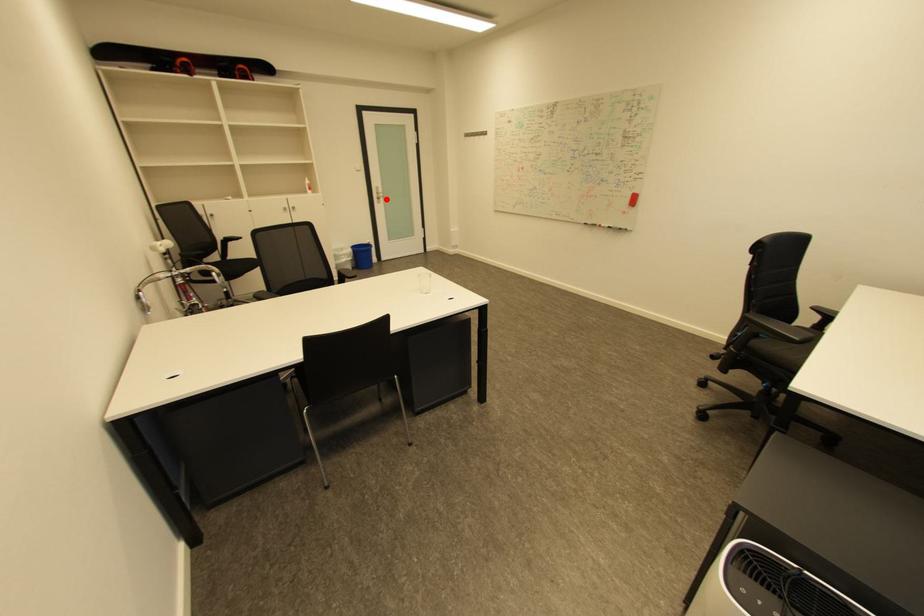
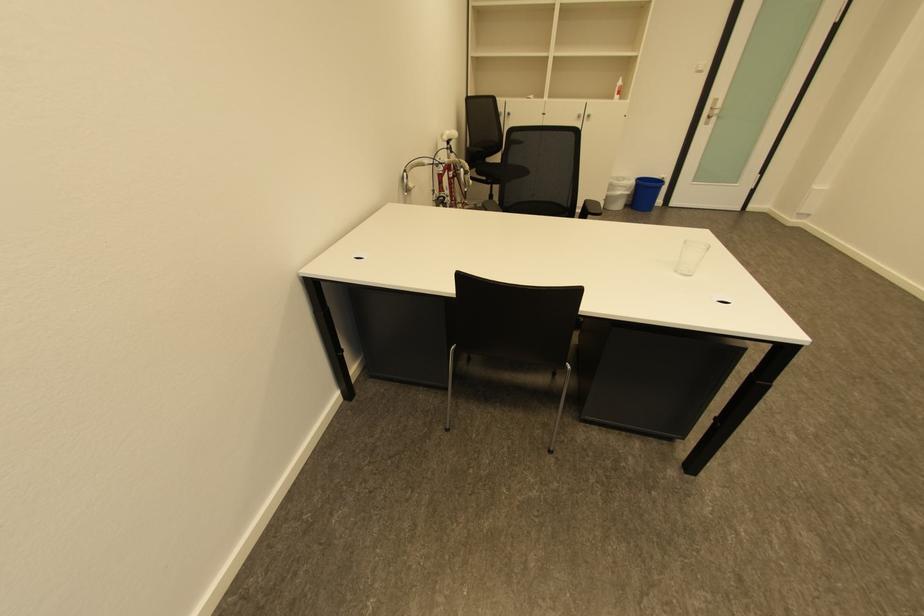
In the second image, find the point that corresponds to the highlighted location in the first image.

(715, 119)